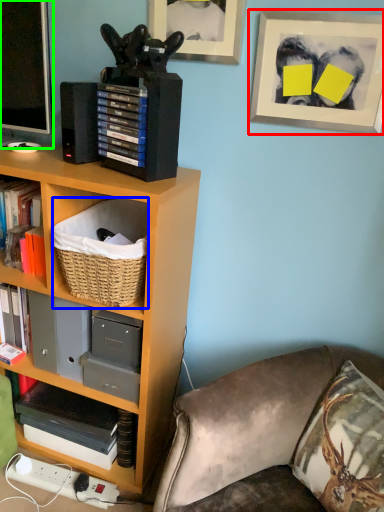
Question: Considering the real-world distances, which object is closest to picture frame (highlighted by a red box)? basket (highlighted by a blue box) or television (highlighted by a green box).

Choices:
 (A) basket
 (B) television

Answer: (A)